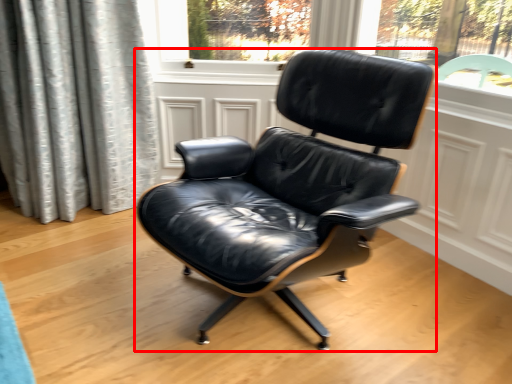
Question: From the image's perspective, considering the relative positions of chair (annotated by the red box) and screen door in the image provided, where is chair (annotated by the red box) located with respect to the staircase?

Choices:
 (A) above
 (B) below

Answer: (B)